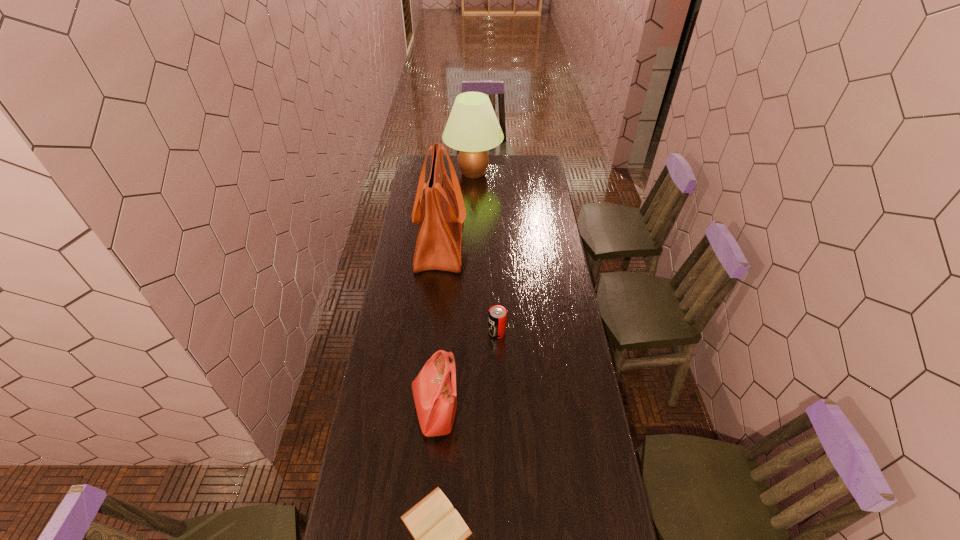
Identify the location of the farthest object. This screenshot has width=960, height=540. (472, 128).

I want to click on shopping bag, so click(442, 212).

I want to click on the fourth farthest object, so click(435, 398).

The image size is (960, 540). In order to click on handbag in this screenshot , I will do `click(435, 398)`.

What are the coordinates of `the second shortest object` in the screenshot? It's located at point(497,316).

The width and height of the screenshot is (960, 540). In order to click on can in this screenshot , I will do `click(497, 316)`.

Locate an element on the screen. free location located on the shade of the lampshade is located at coordinates (547, 173).

The image size is (960, 540). I want to click on vacant area located on the front pocket of the shopping bag, so click(493, 242).

Where is `vacant space located 0.330m on the front-facing side of the handbag`? vacant space located 0.330m on the front-facing side of the handbag is located at coordinates (549, 409).

Image resolution: width=960 pixels, height=540 pixels. Identify the location of free space located 0.090m on the left of the second shortest object. (467, 333).